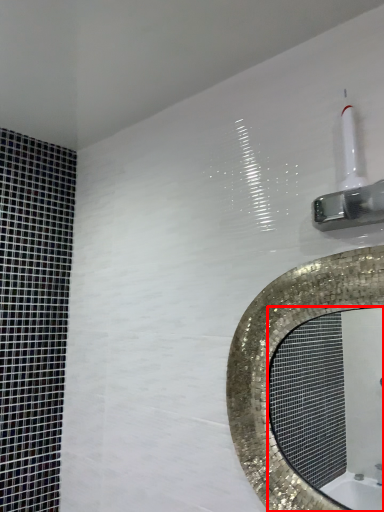
Question: Observing the image, what is the correct spatial positioning of mirror (annotated by the red box) in reference to shower?

Choices:
 (A) right
 (B) left

Answer: (B)